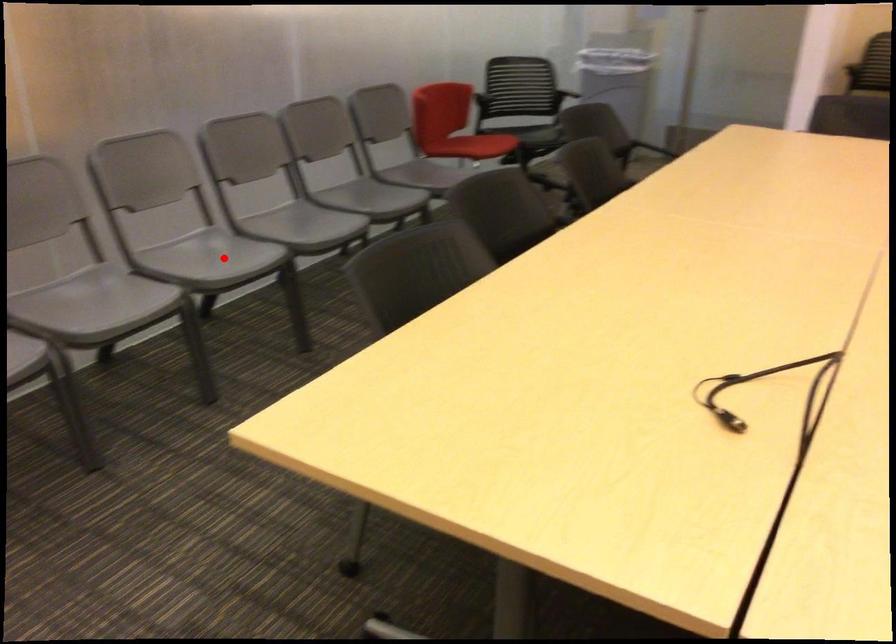
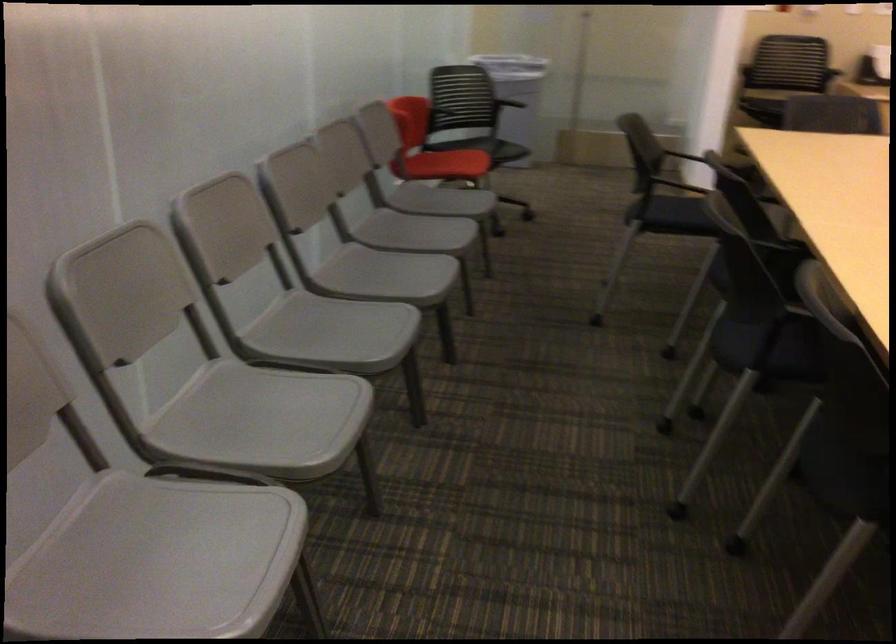
Question: A red point is marked in image1. In image2, is the corresponding 3D point closer to the camera or farther? Reply with the corresponding letter.

Choices:
 (A) The corresponding 3D point is closer.
 (B) The corresponding 3D point is farther.

Answer: (A)